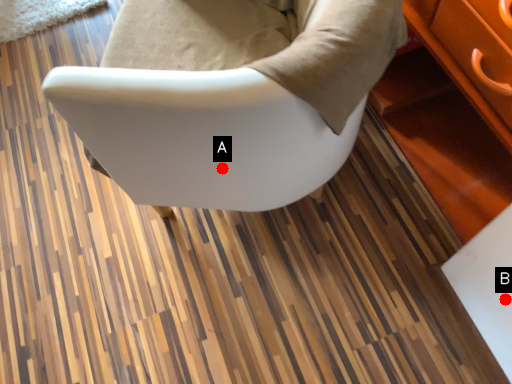
Question: Two points are circled on the image, labeled by A and B beside each circle. Among these points, which one is farthest from the camera?

Choices:
 (A) A is further
 (B) B is further

Answer: (B)